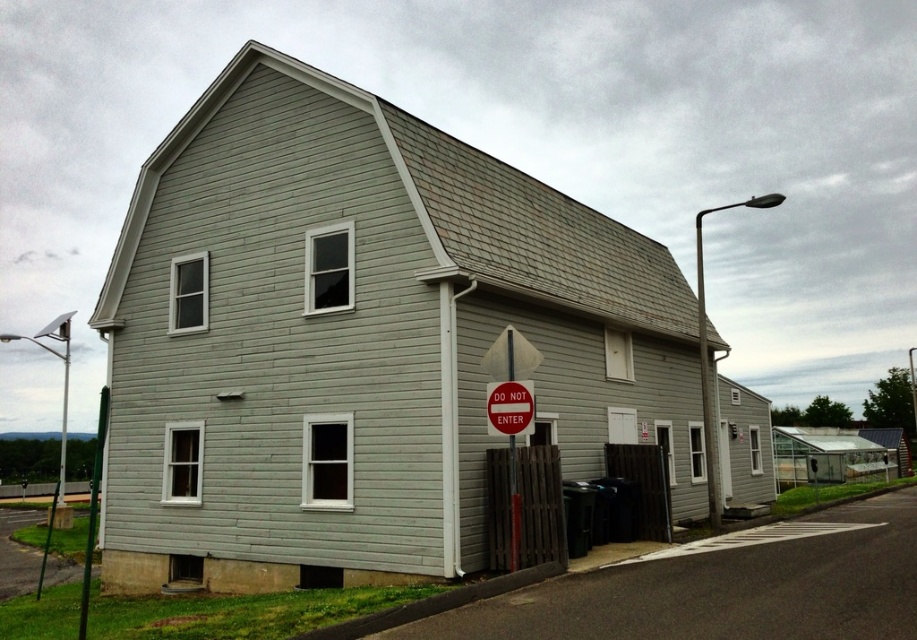
You are standing in front of the two story residential building. You see the smooth gray siding at center and the red plastic sign at center. Which object is higher up from the ground?

The smooth gray siding at center is located above the red plastic sign at center, so it is higher up from the ground.

You are standing in front of the two story residential building described. You notice a point marked at coordinates (361, 340). Based on the scene description, what material is present at that location?

The point at coordinates (361, 340) indicates smooth gray siding at center.